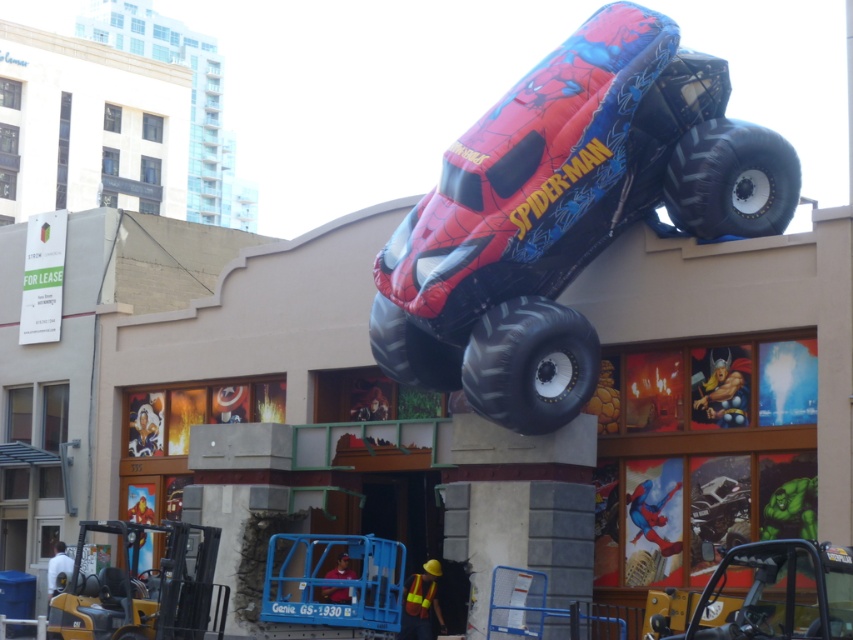
Question: Which object is farther from the camera taking this photo?

Choices:
 (A) matte plastic spider-man monster truck at upper center
 (B) black rubber tire at upper right

Answer: (B)

Question: Is the position of matte plastic spider-man monster truck at upper center less distant than that of black rubber tire at upper right?

Choices:
 (A) no
 (B) yes

Answer: (B)

Question: Which point appears closest to the camera in this image?

Choices:
 (A) (474, 364)
 (B) (416, 333)

Answer: (A)

Question: Based on their relative distances, which object is nearer to the black rubber tire at upper right?

Choices:
 (A) rubber/soft tire at center
 (B) matte plastic spider-man monster truck at upper center
 (C) black rubber tire at lower center

Answer: (B)

Question: Does matte plastic spider-man monster truck at upper center have a greater width compared to black rubber tire at lower center?

Choices:
 (A) no
 (B) yes

Answer: (B)

Question: Can you confirm if matte plastic spider-man monster truck at upper center is positioned to the left of black rubber tire at lower center?

Choices:
 (A) no
 (B) yes

Answer: (A)